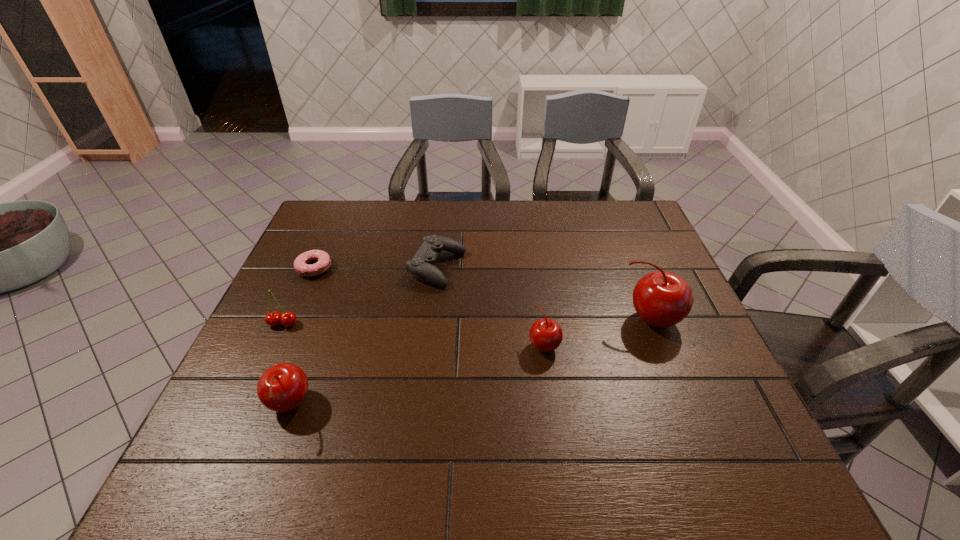
Image resolution: width=960 pixels, height=540 pixels. I want to click on vacant point that satisfies the following two spatial constraints: 1. on the front side of the rightmost object; 2. on the right side of the doughnut, so click(292, 320).

Identify the location of blank area in the image that satisfies the following two spatial constraints: 1. on the back side of the nearest object; 2. on the left side of the rightmost object. (321, 320).

The width and height of the screenshot is (960, 540). I want to click on vacant space that satisfies the following two spatial constraints: 1. on the back side of the nearest object; 2. on the right side of the second cherry from right to left, so click(312, 345).